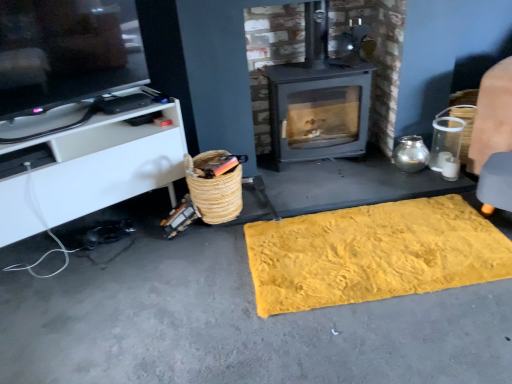
Question: Does woven straw basket at lower left have a lesser height compared to matte black tv at upper left?

Choices:
 (A) no
 (B) yes

Answer: (B)

Question: Is woven straw basket at lower left touching matte black tv at upper left?

Choices:
 (A) yes
 (B) no

Answer: (B)

Question: Is woven straw basket at lower left positioned behind matte black tv at upper left?

Choices:
 (A) no
 (B) yes

Answer: (B)

Question: Does woven straw basket at lower left have a lesser width compared to matte black tv at upper left?

Choices:
 (A) no
 (B) yes

Answer: (A)

Question: Is the depth of woven straw basket at lower left less than that of matte black tv at upper left?

Choices:
 (A) no
 (B) yes

Answer: (A)

Question: From a real-world perspective, is woven straw basket at lower left physically below matte black tv at upper left?

Choices:
 (A) yes
 (B) no

Answer: (A)

Question: Is yellow textured mat at center located within yellow textured rug at lower center?

Choices:
 (A) no
 (B) yes

Answer: (B)

Question: Is there a large distance between yellow textured rug at lower center and yellow textured mat at center?

Choices:
 (A) yes
 (B) no

Answer: (B)

Question: Is yellow textured rug at lower center turned away from yellow textured mat at center?

Choices:
 (A) yes
 (B) no

Answer: (A)

Question: Does yellow textured rug at lower center have a greater height compared to yellow textured mat at center?

Choices:
 (A) no
 (B) yes

Answer: (A)

Question: Is yellow textured rug at lower center next to yellow textured mat at center?

Choices:
 (A) yes
 (B) no

Answer: (B)

Question: Is yellow textured rug at lower center wider than yellow textured mat at center?

Choices:
 (A) yes
 (B) no

Answer: (A)

Question: Considering the relative positions of matte black tv at upper left and yellow textured mat at center in the image provided, is matte black tv at upper left to the left of yellow textured mat at center from the viewer's perspective?

Choices:
 (A) no
 (B) yes

Answer: (B)